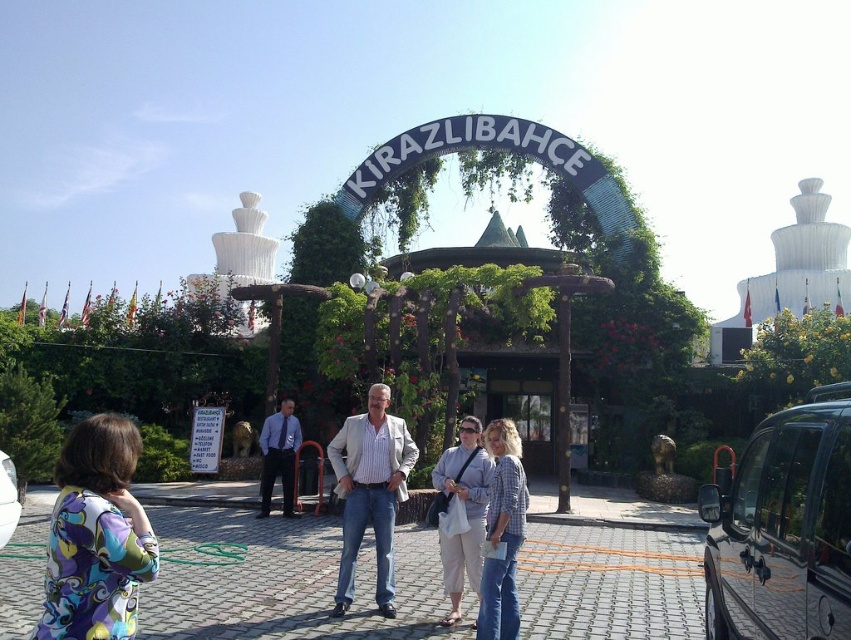
Question: Which is nearer to the printed fabric dress at lower left?

Choices:
 (A) plaid shirt at center
 (B) green leafy arch at center
 (C) striped cotton shirt at center
 (D) light blue shirt at center

Answer: (C)

Question: Is light beige pants at center thinner than light blue shirt at center?

Choices:
 (A) yes
 (B) no

Answer: (B)

Question: Among these points, which one is nearest to the camera?

Choices:
 (A) (346, 476)
 (B) (294, 512)

Answer: (A)

Question: Does plaid shirt at center appear under light blue shirt at center?

Choices:
 (A) yes
 (B) no

Answer: (A)

Question: Among these points, which one is farthest from the camera?

Choices:
 (A) (118, 522)
 (B) (820, 186)
 (C) (261, 499)

Answer: (B)

Question: Is printed fabric dress at lower left in front of striped cotton shirt at center?

Choices:
 (A) yes
 (B) no

Answer: (A)